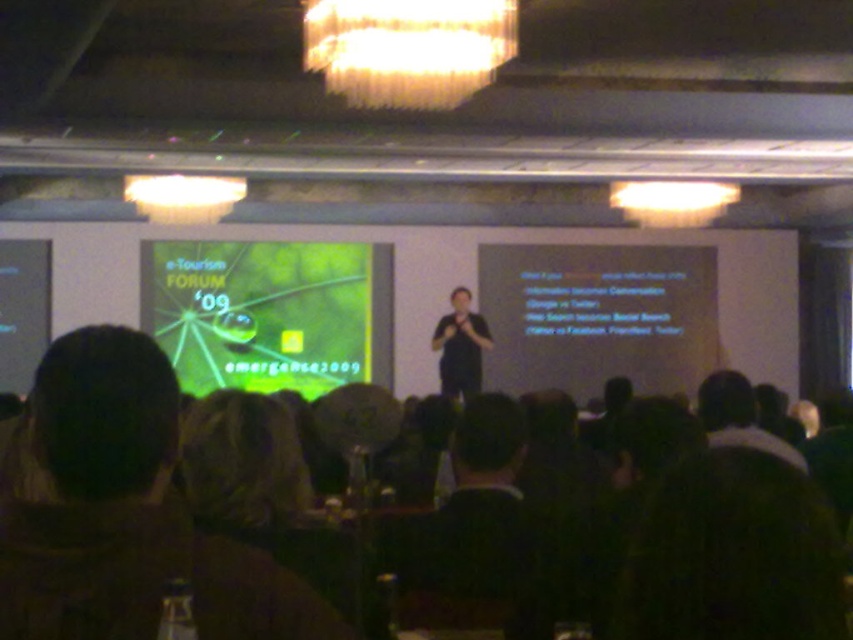
Question: Which point is farther to the camera?

Choices:
 (A) black matte shirt at center
 (B) green matte projection screen at center
 (C) dark brown hair at lower left

Answer: (B)

Question: Which object is farther from the camera taking this photo?

Choices:
 (A) dark green fabric at lower right
 (B) dark brown hair at center

Answer: (B)

Question: Can you confirm if dark brown hair at lower left is positioned below green matte projection screen at center?

Choices:
 (A) yes
 (B) no

Answer: (A)

Question: Is the position of dark brown hair at lower left less distant than that of dark green fabric at lower right?

Choices:
 (A) no
 (B) yes

Answer: (A)

Question: Which point is closer to the camera taking this photo?

Choices:
 (A) (463, 300)
 (B) (634, 634)

Answer: (B)

Question: Can you confirm if green matte projection screen at center is bigger than dark brown hair at center?

Choices:
 (A) no
 (B) yes

Answer: (B)